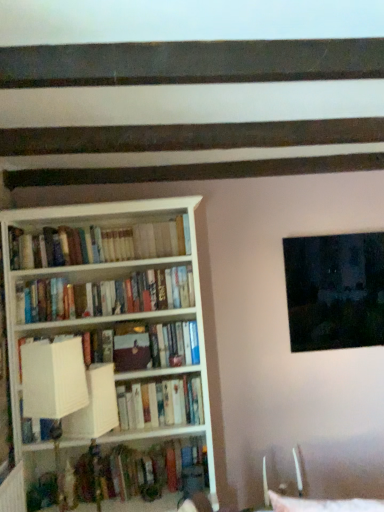
Where is `free space above hardcover books at center, which ranks as the third book in bottom-to-top order (from a real-world perspective)`? free space above hardcover books at center, which ranks as the third book in bottom-to-top order (from a real-world perspective) is located at coordinates (104, 273).